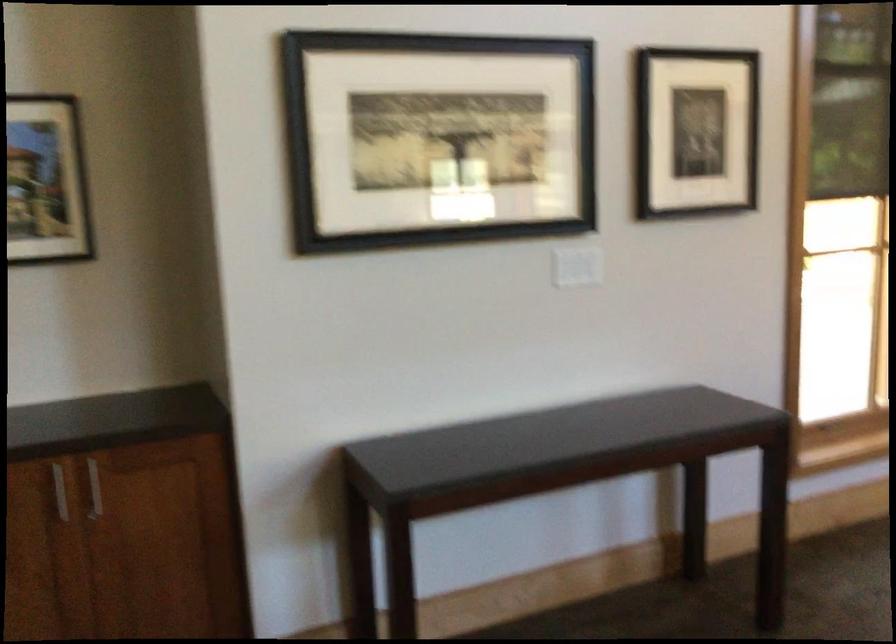
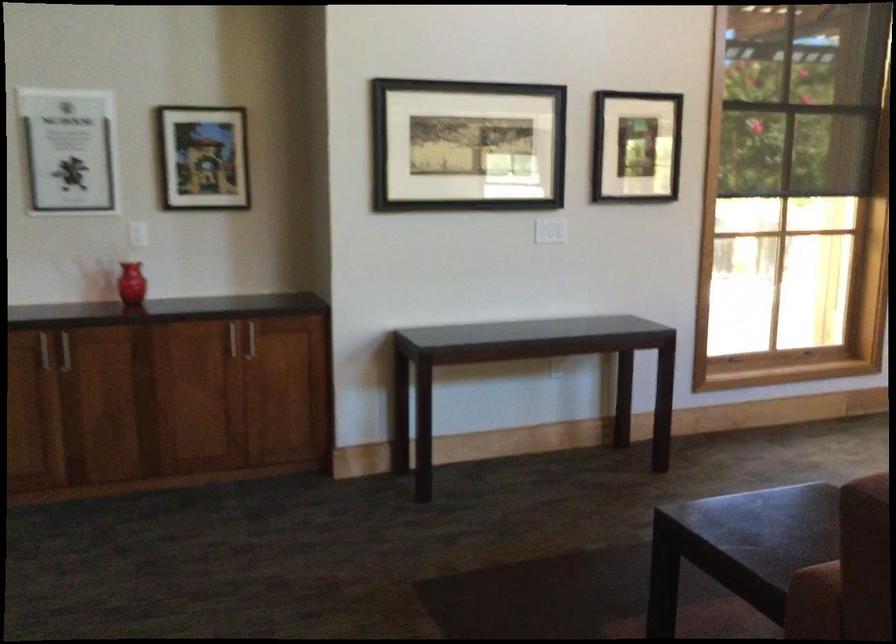
Question: In a continuous first-person perspective shot, in which direction is the camera moving?

Choices:
 (A) Left
 (B) Right
 (C) Forward
 (D) Backward

Answer: (D)